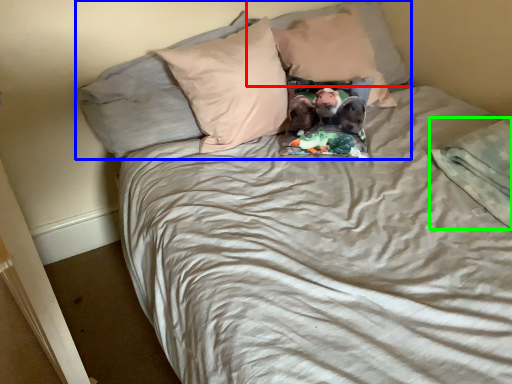
Question: Which is nearer to the pillow (highlighted by a red box)? pillow (highlighted by a blue box) or blanket (highlighted by a green box).

Choices:
 (A) pillow
 (B) blanket

Answer: (A)